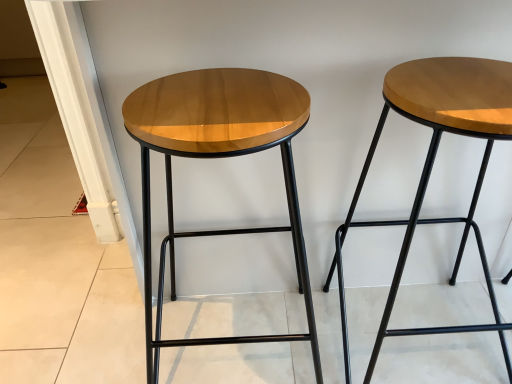
Where is `empty space that is ontop of glossy wood stool at right, which ranks as the second stool in left-to-right order (from a real-world perspective)`? empty space that is ontop of glossy wood stool at right, which ranks as the second stool in left-to-right order (from a real-world perspective) is located at coordinates (453, 84).